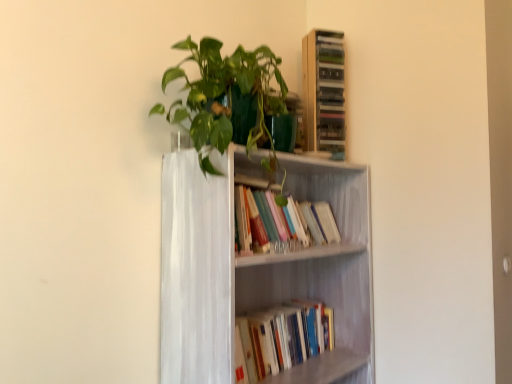
Find the location of `green glossy plant at upper center`. green glossy plant at upper center is located at coordinates (226, 99).

What do you see at coordinates (226, 99) in the screenshot? This screenshot has width=512, height=384. I see `green glossy plant at upper center` at bounding box center [226, 99].

What do you see at coordinates (323, 91) in the screenshot? I see `wooden cabinet at upper right` at bounding box center [323, 91].

You are a GUI agent. You are given a task and a screenshot of the screen. Output one action in this format:
    pyautogui.click(x=<x>, y=<y>)
    Task: Click on the hardcover books at center, the first book in the bottom-to-top sequence
    
    Given the screenshot: What is the action you would take?
    pyautogui.click(x=287, y=335)

The width and height of the screenshot is (512, 384). Find the location of `white painted wood bookcase at center`. white painted wood bookcase at center is located at coordinates pyautogui.click(x=259, y=268).

This screenshot has height=384, width=512. I want to click on houseplant below the wooden cabinet at upper right (from the image's perspective), so click(226, 99).

From a real-world perspective, is wooden cabinet at upper right positioned above or below green glossy plant at upper center?

From a real-world perspective, wooden cabinet at upper right is physically above green glossy plant at upper center.

Is wooden cabinet at upper right aimed at green glossy plant at upper center?

No.

Can you see wooden cabinet at upper right touching green glossy plant at upper center?

No, wooden cabinet at upper right is not beside green glossy plant at upper center.

Can you tell me how much hardcover books at center, the first book in the bottom-to-top sequence, and wooden cabinet at upper right differ in facing direction?

The facing directions of hardcover books at center, the first book in the bottom-to-top sequence, and wooden cabinet at upper right are 28.1 degrees apart.

Is hardcover books at center, the first book in the bottom-to-top sequence, in front of or behind wooden cabinet at upper right in the image?

Clearly, hardcover books at center, the first book in the bottom-to-top sequence, is in front of wooden cabinet at upper right.

Would you say hardcover books at center, the first book in the bottom-to-top sequence, is inside or outside wooden cabinet at upper right?

hardcover books at center, the first book in the bottom-to-top sequence, is not enclosed by wooden cabinet at upper right.

From the image's perspective, is hardcover books at center, the first book in the bottom-to-top sequence, positioned above or below wooden cabinet at upper right?

hardcover books at center, the first book in the bottom-to-top sequence, is below wooden cabinet at upper right.

Are green glossy plant at upper center and wooden cabinet at upper right far apart?

No, green glossy plant at upper center is in close proximity to wooden cabinet at upper right.

From the image's perspective, does green glossy plant at upper center appear lower than wooden cabinet at upper right?

Yes.

Do you think green glossy plant at upper center is within wooden cabinet at upper right, or outside of it?

The correct answer is: outside.

Does point (285, 84) come in front of point (314, 104)?

Yes, it is in front of point (314, 104).

From the image's perspective, does wooden cabinet at upper right appear lower than hardcover books at center, marked as the second book in a bottom-to-top arrangement?

No, from the image's perspective, wooden cabinet at upper right is not beneath hardcover books at center, marked as the second book in a bottom-to-top arrangement.

Is wooden cabinet at upper right oriented towards hardcover books at center, marked as the second book in a bottom-to-top arrangement?

No, wooden cabinet at upper right is not aimed at hardcover books at center, marked as the second book in a bottom-to-top arrangement.

Could hardcover books at center, marked as the second book in a bottom-to-top arrangement, be considered to be inside wooden cabinet at upper right?

Definitely not — hardcover books at center, marked as the second book in a bottom-to-top arrangement, is not inside wooden cabinet at upper right.

Is wooden cabinet at upper right not near hardcover books at center, marked as the second book in a bottom-to-top arrangement?

That's not correct — wooden cabinet at upper right is a little close to hardcover books at center, marked as the second book in a bottom-to-top arrangement.

You are a GUI agent. You are given a task and a screenshot of the screen. Output one action in this format:
    pyautogui.click(x=<x>, y=<y>)
    Task: Click on the bookcase directly beneath the wooden cabinet at upper right (from a real-world perspective)
    Image resolution: width=512 pixels, height=384 pixels.
    Given the screenshot: What is the action you would take?
    pyautogui.click(x=259, y=268)

Based on the photo, which of these two, white painted wood bookcase at center or wooden cabinet at upper right, stands taller?

Standing taller between the two is white painted wood bookcase at center.

Can you confirm if white painted wood bookcase at center is bigger than wooden cabinet at upper right?

Yes, white painted wood bookcase at center is bigger than wooden cabinet at upper right.

Between white painted wood bookcase at center and hardcover books at center, marked as the second book in a bottom-to-top arrangement, which one has larger width?

white painted wood bookcase at center is wider.

Is white painted wood bookcase at center positioned before hardcover books at center, marked as the second book in a bottom-to-top arrangement?

Yes, white painted wood bookcase at center is closer to the camera.

Is white painted wood bookcase at center looking in the opposite direction of hardcover books at center, the first book positioned from the top?

Absolutely, white painted wood bookcase at center is directed away from hardcover books at center, the first book positioned from the top.

Looking at this image, from a real-world perspective, is white painted wood bookcase at center beneath hardcover books at center, the first book positioned from the top?

Yes, from a real-world perspective, white painted wood bookcase at center is under hardcover books at center, the first book positioned from the top.

What's the angular difference between green glossy plant at upper center and hardcover books at center, the first book positioned from the top,'s facing directions?

The angle between the facing direction of green glossy plant at upper center and the facing direction of hardcover books at center, the first book positioned from the top, is 0.000318 degrees.

From the image's perspective, between green glossy plant at upper center and hardcover books at center, the first book positioned from the top, who is located below?

From the image's view, hardcover books at center, the first book positioned from the top, is below.

The image size is (512, 384). Identify the location of houseplant on the left of hardcover books at center, marked as the second book in a bottom-to-top arrangement. (226, 99).

Considering the relative sizes of green glossy plant at upper center and hardcover books at center, the first book positioned from the top, in the image provided, is green glossy plant at upper center bigger than hardcover books at center, the first book positioned from the top,?

Yes, green glossy plant at upper center is bigger than hardcover books at center, the first book positioned from the top.

In order to click on shelf above the green glossy plant at upper center (from the image's perspective) in this screenshot , I will do `click(323, 91)`.

From a real-world perspective, starting from the wooden cabinet at upper right, which book is the 2nd one below it? Please provide its 2D coordinates.

[(287, 335)]

When comparing their distances from wooden cabinet at upper right, does green glossy plant at upper center or hardcover books at center, the second book when ordered from top to bottom, seem closer?

green glossy plant at upper center.

Based on their spatial positions, is wooden cabinet at upper right or green glossy plant at upper center closer to white painted wood bookcase at center?

green glossy plant at upper center is positioned closer to the anchor white painted wood bookcase at center.

Based on their spatial positions, is green glossy plant at upper center or wooden cabinet at upper right further from hardcover books at center, marked as the second book in a bottom-to-top arrangement?

The object further to hardcover books at center, marked as the second book in a bottom-to-top arrangement, is wooden cabinet at upper right.

Estimate the real-world distances between objects in this image. Which object is further from white painted wood bookcase at center, wooden cabinet at upper right or hardcover books at center, marked as the second book in a bottom-to-top arrangement?

wooden cabinet at upper right.

When comparing their distances from hardcover books at center, the second book when ordered from top to bottom, does wooden cabinet at upper right or hardcover books at center, the first book positioned from the top, seem closer?

hardcover books at center, the first book positioned from the top, is closer to hardcover books at center, the second book when ordered from top to bottom.

Which object lies nearer to the anchor point hardcover books at center, the first book in the bottom-to-top sequence, green glossy plant at upper center or hardcover books at center, the first book positioned from the top?

hardcover books at center, the first book positioned from the top, is positioned closer to the anchor hardcover books at center, the first book in the bottom-to-top sequence.

Estimate the real-world distances between objects in this image. Which object is closer to white painted wood bookcase at center, hardcover books at center, the first book in the bottom-to-top sequence, or hardcover books at center, the first book positioned from the top?

hardcover books at center, the first book positioned from the top, lies closer to white painted wood bookcase at center than the other object.

Estimate the real-world distances between objects in this image. Which object is closer to green glossy plant at upper center, wooden cabinet at upper right or white painted wood bookcase at center?

The object closer to green glossy plant at upper center is white painted wood bookcase at center.

What are the coordinates of `book between green glossy plant at upper center and hardcover books at center, the first book in the bottom-to-top sequence, vertically` in the screenshot? It's located at (289, 220).

Locate an element on the screen. This screenshot has width=512, height=384. book between wooden cabinet at upper right and white painted wood bookcase at center from top to bottom is located at coordinates (289, 220).

Find the location of a particular element. book between green glossy plant at upper center and white painted wood bookcase at center in the vertical direction is located at coordinates (289, 220).

Where is `bookcase between hardcover books at center, the first book positioned from the top, and hardcover books at center, the first book in the bottom-to-top sequence, in the vertical direction`? bookcase between hardcover books at center, the first book positioned from the top, and hardcover books at center, the first book in the bottom-to-top sequence, in the vertical direction is located at coordinates (259, 268).